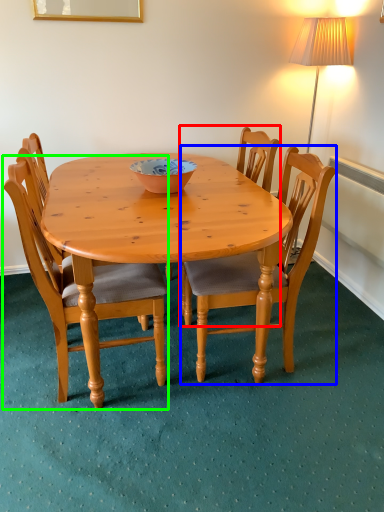
Question: Which is nearer to the chair (highlighted by a red box)? chair (highlighted by a blue box) or chair (highlighted by a green box).

Choices:
 (A) chair
 (B) chair

Answer: (A)